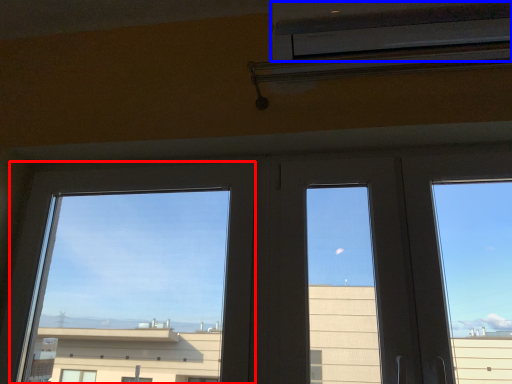
Question: Which point is further to the camera, window (highlighted by a red box) or air conditioning (highlighted by a blue box)?

Choices:
 (A) window
 (B) air conditioning

Answer: (A)